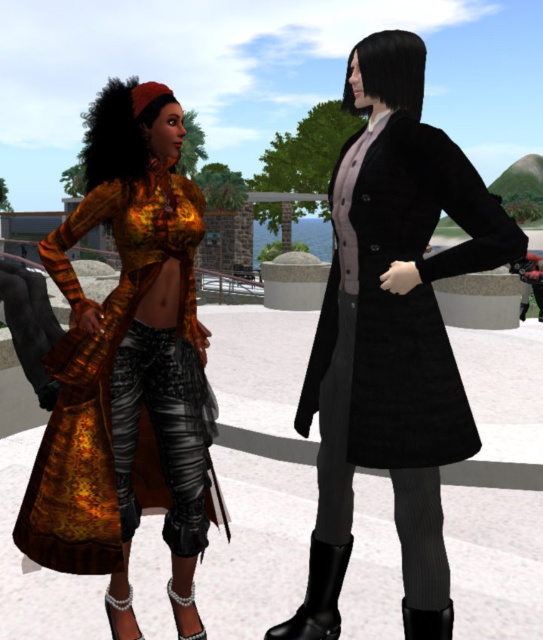
Where is the shiny metallic dress at center located in the image?

The shiny metallic dress at center is located at point [128,358].